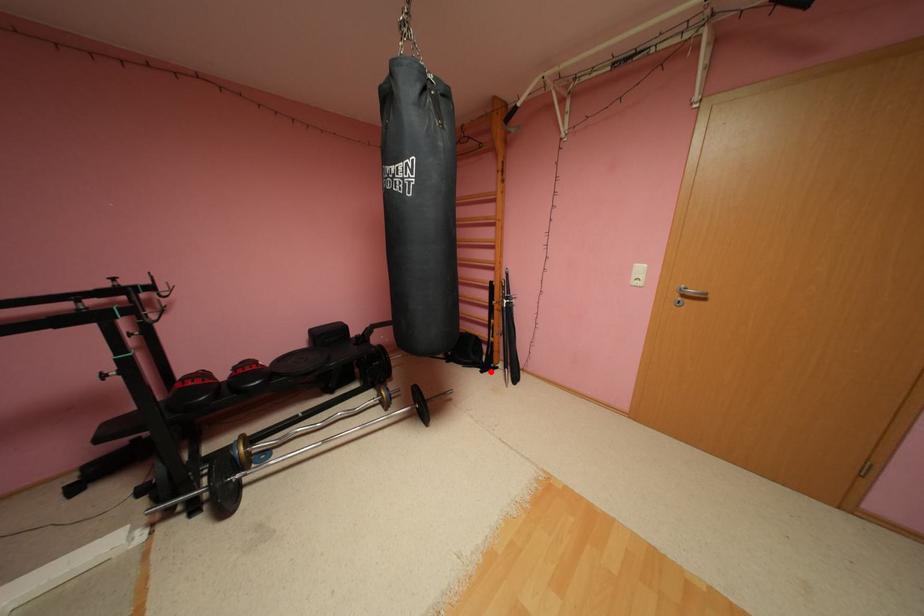
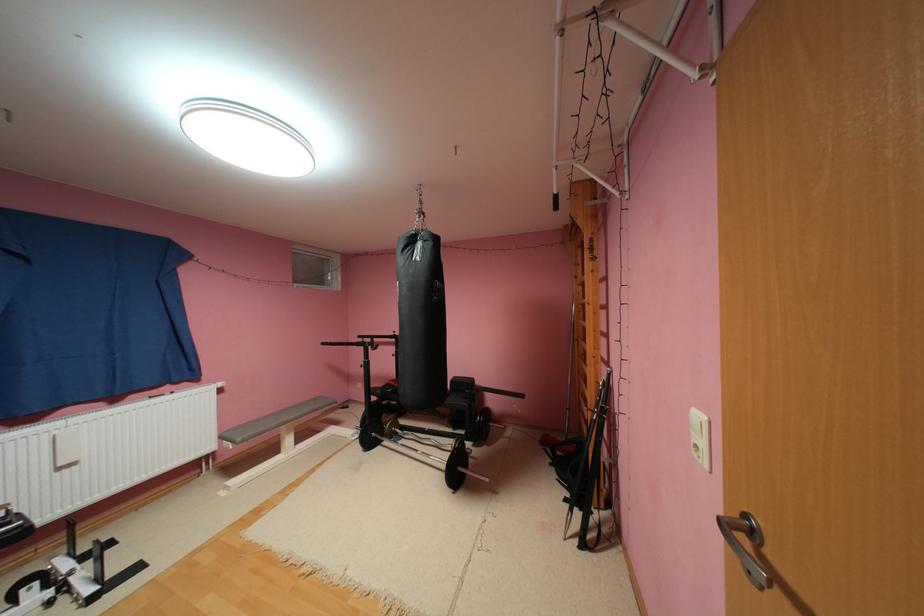
Question: I am providing you with two images of the same scene from different viewpoints. In image1, a red point is highlighted. Considering the same 3D point in image2, which of the following is correct?

Choices:
 (A) It is closer
 (B) It is farther

Answer: (A)